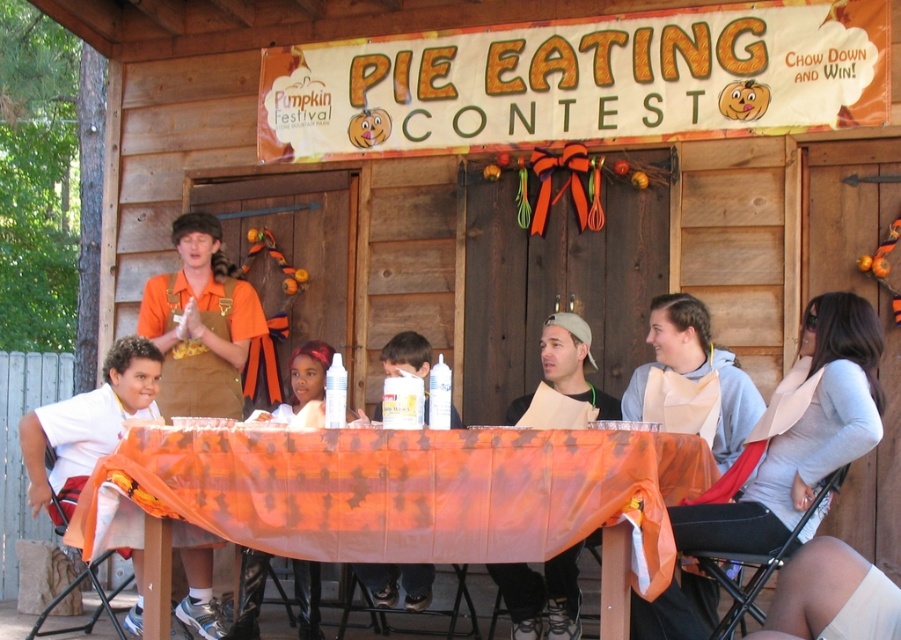
Question: Can you confirm if white glossy lotion at center is positioned to the right of white glossy can at center?

Choices:
 (A) no
 (B) yes

Answer: (A)

Question: Which of the following is the closest to the observer?

Choices:
 (A) (203, 371)
 (B) (243, 634)
 (C) (447, 548)

Answer: (C)

Question: Does orange sheer fabric at center come in front of white glossy can at center?

Choices:
 (A) yes
 (B) no

Answer: (A)

Question: Does light beige paper bib at lower right appear on the right side of white paper bib at center?

Choices:
 (A) yes
 (B) no

Answer: (A)

Question: Which object appears closest to the camera in this image?

Choices:
 (A) orange fabric apron at left
 (B) white matte shirt at left
 (C) white glossy lotion at center

Answer: (B)

Question: Estimate the real-world distances between objects in this image. Which object is closer to the white paper bib at center?

Choices:
 (A) light beige paper bib at lower right
 (B) white glossy lotion at center
 (C) orange fabric apron at left

Answer: (B)